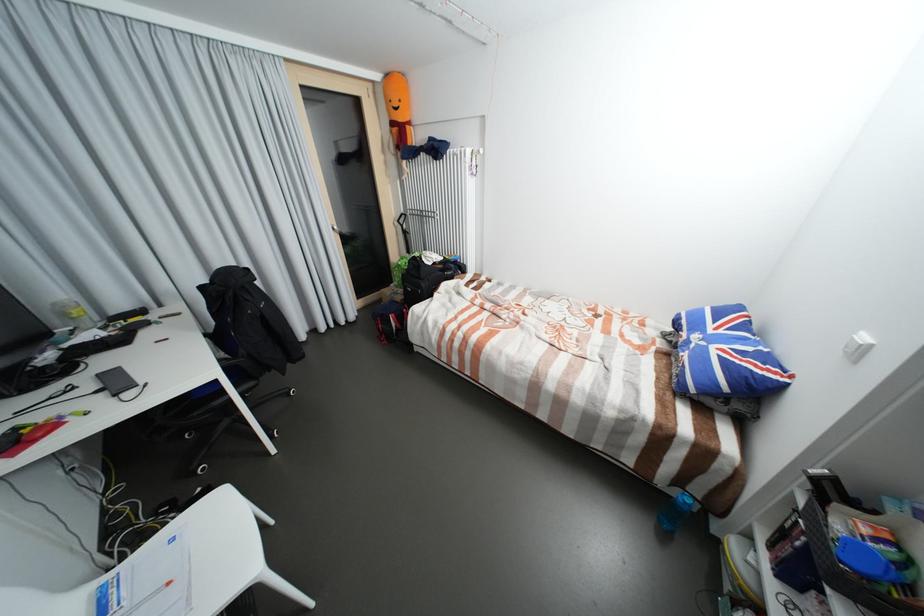
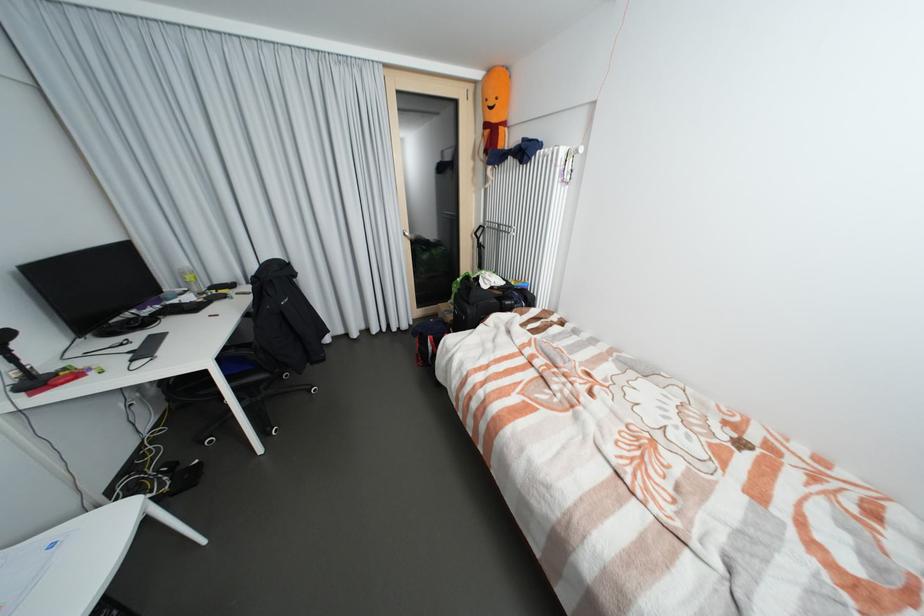
The point at (178, 541) is marked in the first image. Where is the corresponding point in the second image?

(59, 546)